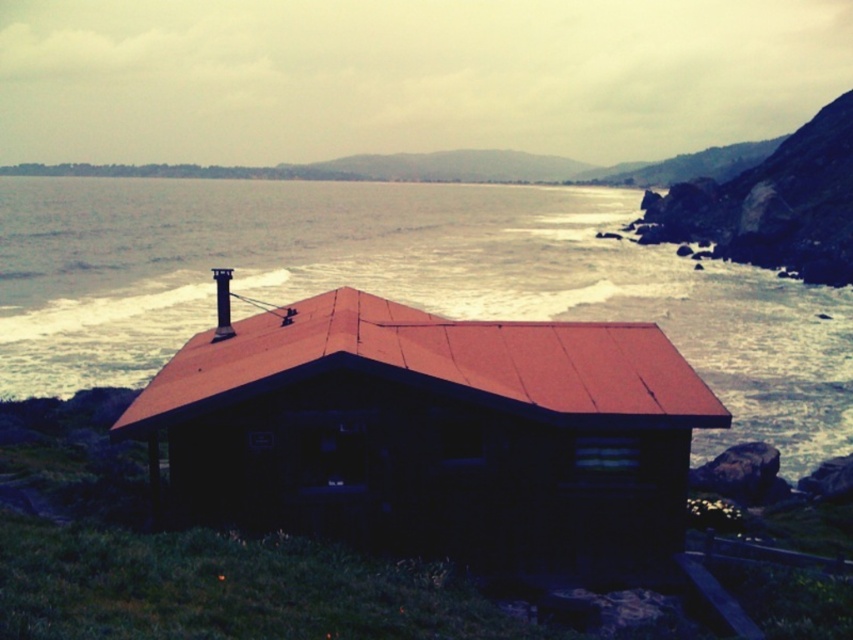
You are standing on the rocky cliff and want to take a photo of the wooden log cabin at center. However, you notice the oily gray water at center might be distracting. Which direction should you move to position the cabin away from the water in your photo?

Move to the right side so that the wooden log cabin at center is positioned to the right of the oily gray water at center, thus moving the cabin away from the water in your photo.

You are standing on the cliff edge overlooking the scene. You see the oily gray water at center and the wooden log cabin at center. Which object appears larger in the image?

The oily gray water at center appears larger because it is taller than the wooden log cabin at center.